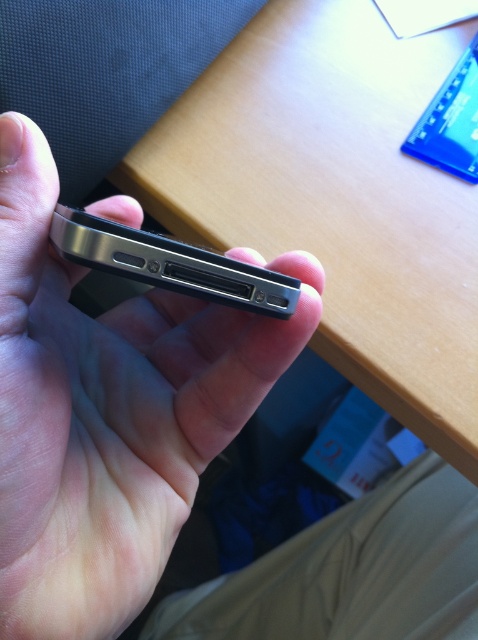
Question: Among these objects, which one is farthest from the camera?

Choices:
 (A) black matte phone at center
 (B) wooden table at center

Answer: (B)

Question: Among these objects, which one is farthest from the camera?

Choices:
 (A) wooden table at center
 (B) satin black smartphone at center
 (C) black matte phone at center

Answer: (A)

Question: Is wooden table at center behind satin black smartphone at center?

Choices:
 (A) no
 (B) yes

Answer: (B)

Question: Does black matte phone at center appear on the right side of satin black smartphone at center?

Choices:
 (A) yes
 (B) no

Answer: (B)

Question: Which point is closer to the camera?

Choices:
 (A) satin black smartphone at center
 (B) black matte phone at center

Answer: (B)

Question: Does wooden table at center appear under black matte phone at center?

Choices:
 (A) yes
 (B) no

Answer: (B)